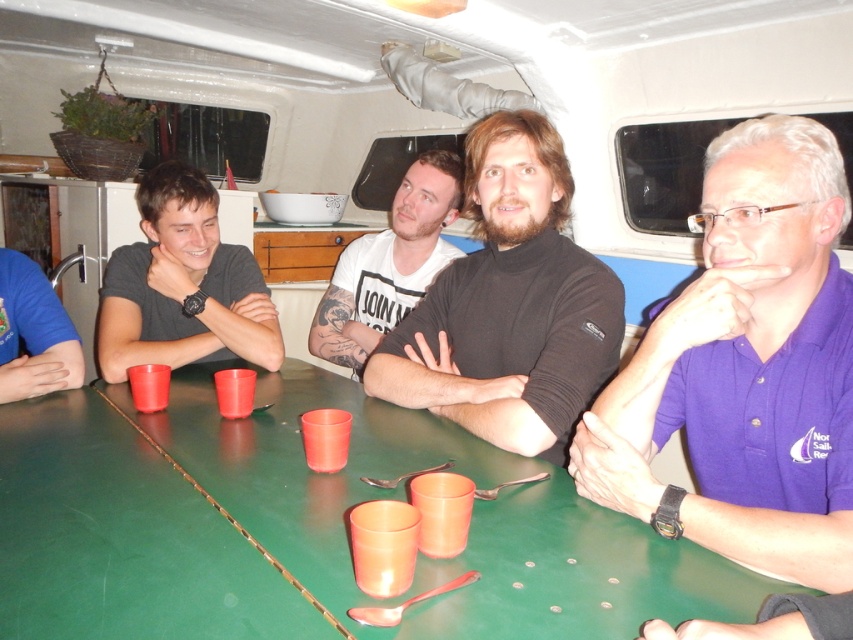
Question: Which is nearer to the green plastic table at center?

Choices:
 (A) translucent plastic cup at center
 (B) matte plastic cup at center
 (C) orange plastic cup at center
 (D) blue cotton shirt at left

Answer: (C)

Question: Can you confirm if black matte t-shirt at center is positioned below matte plastic cup at center?

Choices:
 (A) yes
 (B) no

Answer: (B)

Question: Is blue cotton shirt at left smaller than matte plastic cup at table left?

Choices:
 (A) no
 (B) yes

Answer: (A)

Question: Which of the following is the closest to the observer?

Choices:
 (A) (10, 348)
 (B) (228, 412)

Answer: (B)

Question: Where is orange plastic cup at center located in relation to matte plastic cup at center in the image?

Choices:
 (A) left
 (B) right

Answer: (B)

Question: Estimate the real-world distances between objects in this image. Which object is farther from the green plastic table at center?

Choices:
 (A) black matte turtleneck at center
 (B) blue cotton shirt at left
 (C) matte black shirt at left

Answer: (B)